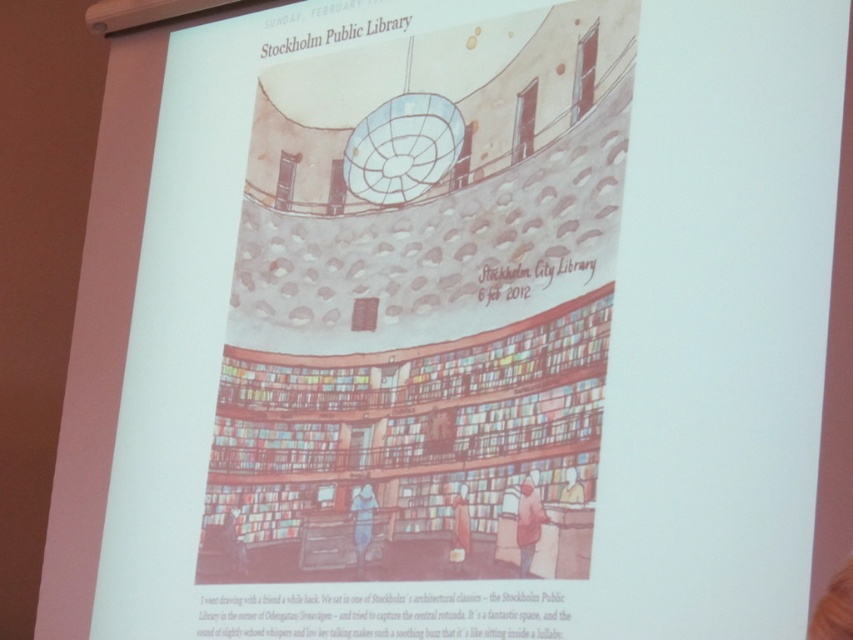
You are a visitor in the library and you see the denim jacket at lower center and the light blue fabric at lower center. Which object is closer to the ceiling?

The denim jacket at lower center is located above the light blue fabric at lower center, so it is closer to the ceiling.

You are a visitor in the Stockholm Public Library and you see the light brown fabric jacket at lower center and the smooth beige coat at lower center. Which one is closer to the ceiling?

The light brown fabric jacket at lower center is above the smooth beige coat at lower center, so it is closer to the ceiling.

You are organizing a small event in the library and need to place a table between the denim jacket at lower center and the light blue fabric at lower center. Which object should you position the table closer to if you want the table to be near the narrower item?

The denim jacket at lower center has a lesser width compared to the light blue fabric at lower center, so you should position the table closer to the denim jacket at lower center to be near the narrower item.